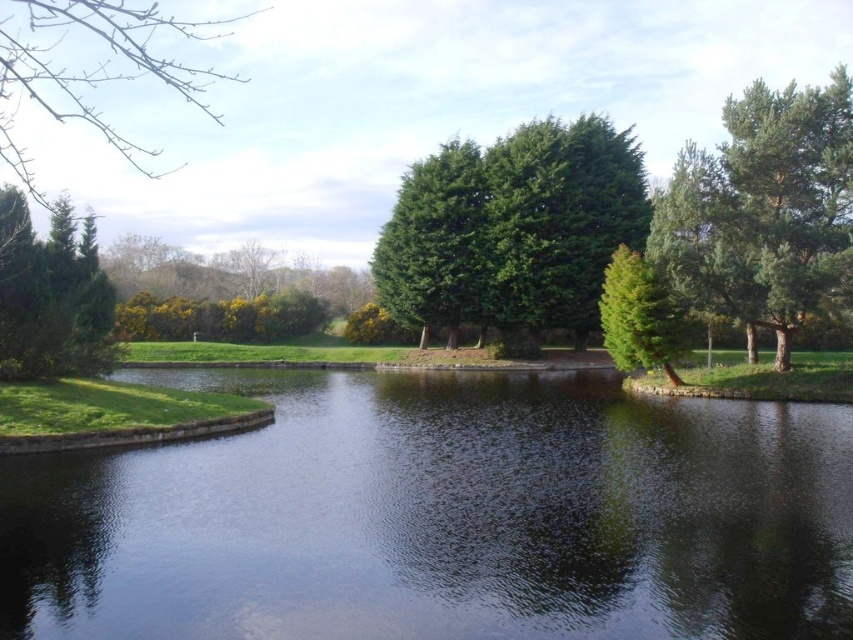
Based on the photo, does green textured tree at center have a smaller size compared to green matte tree at upper left?

Incorrect, green textured tree at center is not smaller in size than green matte tree at upper left.

Between green textured tree at center and green matte tree at upper left, which one has less height?

green matte tree at upper left is shorter.

This screenshot has height=640, width=853. Describe the element at coordinates (514, 228) in the screenshot. I see `green textured tree at center` at that location.

Image resolution: width=853 pixels, height=640 pixels. Find the location of `green textured tree at center`. green textured tree at center is located at coordinates (514, 228).

Does point (123, 636) come closer to viewer compared to point (402, 204)?

That is True.

The height and width of the screenshot is (640, 853). In order to click on transparent water at center in this screenshot , I will do `click(440, 516)`.

Does point (426, 448) lie in front of point (456, 221)?

Yes, it is in front of point (456, 221).

Identify the location of transparent water at center. (440, 516).

Is transparent water at center shorter than green matte tree at upper left?

Indeed, transparent water at center has a lesser height compared to green matte tree at upper left.

Looking at this image, does transparent water at center appear on the right side of green matte tree at upper left?

Indeed, transparent water at center is positioned on the right side of green matte tree at upper left.

Is point (500, 458) closer to camera compared to point (12, 296)?

That is True.

Where is `transparent water at center`? The width and height of the screenshot is (853, 640). transparent water at center is located at coordinates (440, 516).